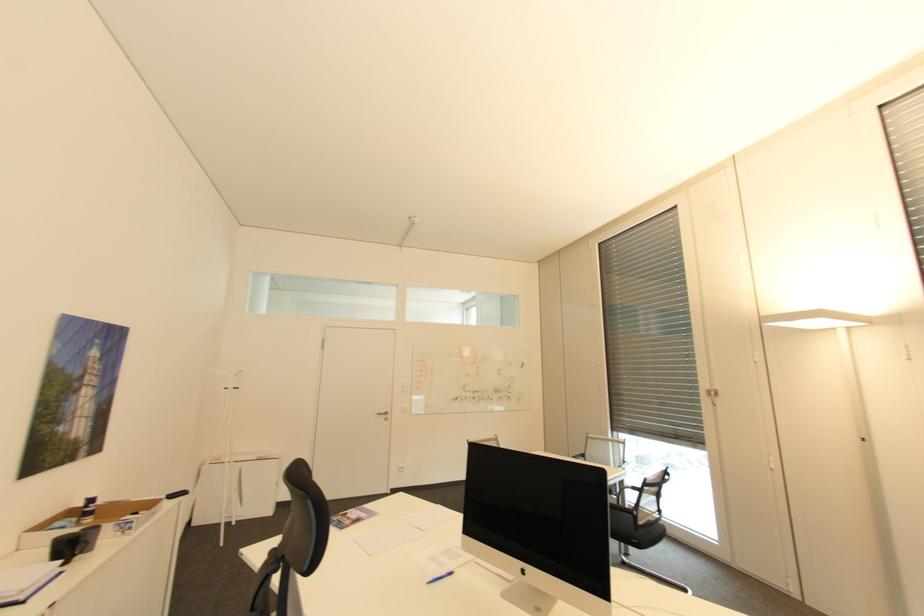
Where would you pull the gold window handle? Please return your answer as a coordinate pair (x, y).

(711, 395)